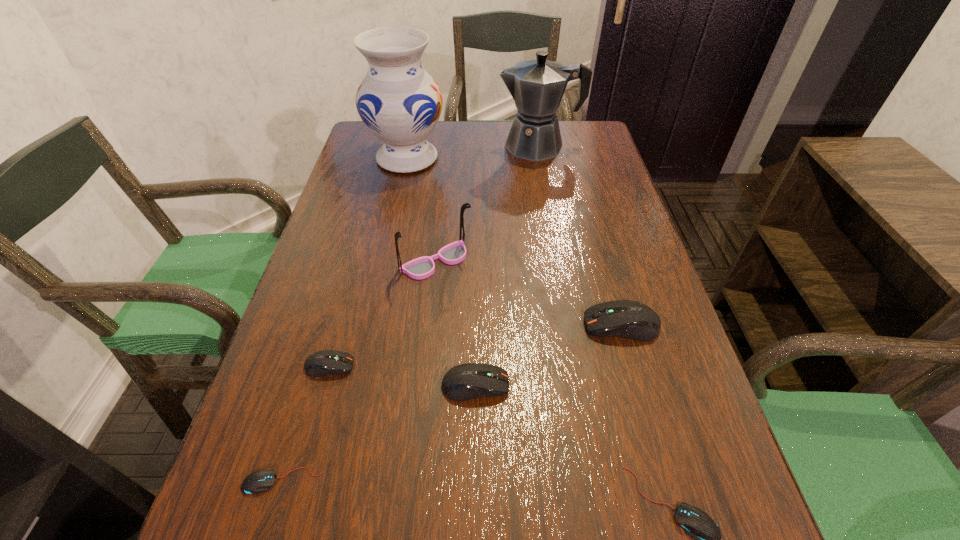
This screenshot has width=960, height=540. I want to click on the sixth tallest object, so click(x=325, y=362).

At what (x,y) coordinates should I click in order to perform the action: click on the shortest mouse. Please return your answer as a coordinate pair (x, y). The image size is (960, 540). Looking at the image, I should click on (262, 480).

Find the location of a particular element. The height and width of the screenshot is (540, 960). the smaller black mouse is located at coordinates (262, 480).

This screenshot has width=960, height=540. Find the location of `vacant area situated 0.270m on the right of the vase`. vacant area situated 0.270m on the right of the vase is located at coordinates (537, 158).

Where is `free space located at the spout of the second tallest object`? The image size is (960, 540). free space located at the spout of the second tallest object is located at coordinates (455, 146).

Locate an element on the screen. free region located 0.070m at the spout of the second tallest object is located at coordinates (475, 146).

Where is `vacant space located 0.340m at the spout of the second tallest object`? The height and width of the screenshot is (540, 960). vacant space located 0.340m at the spout of the second tallest object is located at coordinates (387, 146).

Locate an element on the screen. Image resolution: width=960 pixels, height=540 pixels. free space located 0.050m on the right of the third farthest object is located at coordinates (x=493, y=261).

This screenshot has height=540, width=960. Find the location of `vacant region located 0.180m on the button of the fourth tallest object`. vacant region located 0.180m on the button of the fourth tallest object is located at coordinates (493, 325).

Locate an element on the screen. The height and width of the screenshot is (540, 960). free space located on the button of the fourth tallest object is located at coordinates (498, 325).